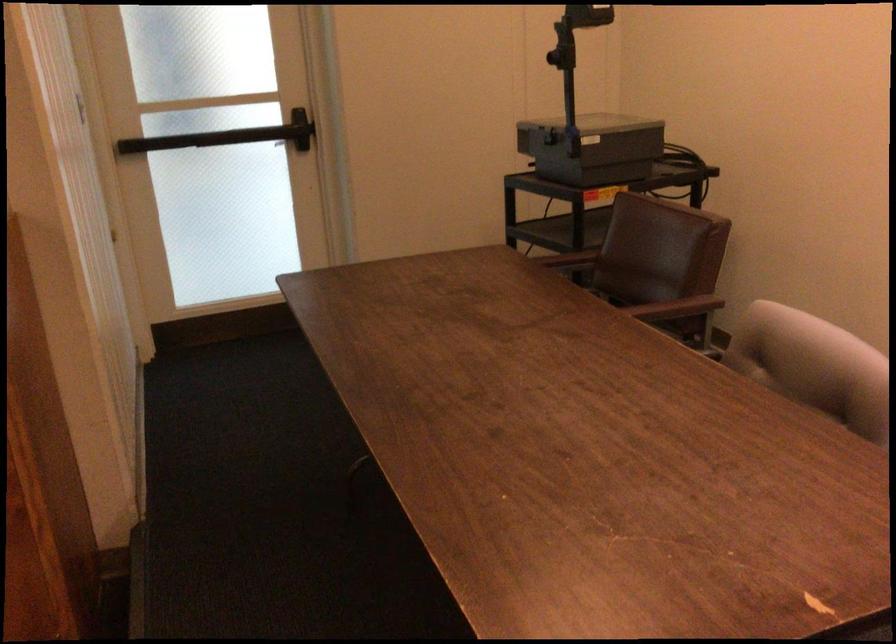
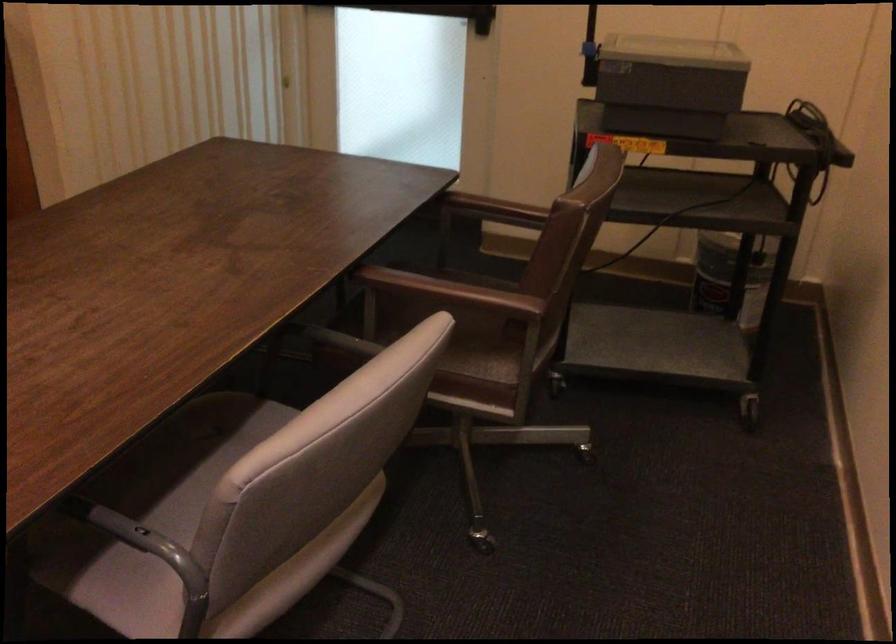
Locate, in the second image, the point that corresponds to [607,144] in the first image.

(668, 84)